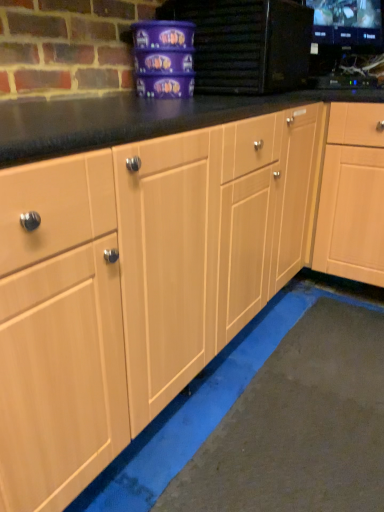
Question: Can you confirm if matte purple container at upper center, the first appliance in the left-to-right sequence, is wider than black glossy monitor at upper right?

Choices:
 (A) yes
 (B) no

Answer: (A)

Question: From a real-world perspective, is matte purple container at upper center, which is the second appliance in right-to-left order, on top of black glossy monitor at upper right?

Choices:
 (A) no
 (B) yes

Answer: (A)

Question: From the image's perspective, is matte purple container at upper center, the first appliance in the left-to-right sequence, located beneath black glossy monitor at upper right?

Choices:
 (A) yes
 (B) no

Answer: (A)

Question: Can you confirm if matte purple container at upper center, which is the second appliance in right-to-left order, is thinner than black glossy monitor at upper right?

Choices:
 (A) no
 (B) yes

Answer: (A)

Question: Is matte purple container at upper center, which is the second appliance in right-to-left order, smaller than black glossy monitor at upper right?

Choices:
 (A) yes
 (B) no

Answer: (B)

Question: Considering the positions of black glossy monitor at upper right and black glossy tv at upper right, which is the first appliance from right to left, in the image, is black glossy monitor at upper right wider or thinner than black glossy tv at upper right, which is the first appliance from right to left,?

Choices:
 (A) wide
 (B) thin

Answer: (B)

Question: Is black glossy monitor at upper right situated inside black glossy tv at upper right, which is the first appliance from right to left, or outside?

Choices:
 (A) inside
 (B) outside

Answer: (B)

Question: Is point (380, 10) closer or farther from the camera than point (321, 79)?

Choices:
 (A) closer
 (B) farther

Answer: (B)

Question: Is black glossy monitor at upper right in front of or behind black glossy tv at upper right, the second appliance when ordered from left to right, in the image?

Choices:
 (A) behind
 (B) front

Answer: (B)

Question: Considering the relative positions of light wood cabinet at center and matte purple container at upper center, which is the second appliance in right-to-left order, in the image provided, is light wood cabinet at center to the left or to the right of matte purple container at upper center, which is the second appliance in right-to-left order,?

Choices:
 (A) left
 (B) right

Answer: (B)

Question: Relative to matte purple container at upper center, the first appliance in the left-to-right sequence, is light wood cabinet at center in front or behind?

Choices:
 (A) behind
 (B) front

Answer: (A)

Question: Do you think light wood cabinet at center is within matte purple container at upper center, which is the second appliance in right-to-left order, or outside of it?

Choices:
 (A) outside
 (B) inside

Answer: (A)

Question: Considering the positions of light wood cabinet at center and matte purple container at upper center, the first appliance in the left-to-right sequence, in the image, is light wood cabinet at center bigger or smaller than matte purple container at upper center, the first appliance in the left-to-right sequence,?

Choices:
 (A) big
 (B) small

Answer: (A)

Question: In terms of height, does matte purple container at upper center, which is the second appliance in right-to-left order, look taller or shorter compared to black glossy tv at upper right, which is the first appliance from right to left?

Choices:
 (A) tall
 (B) short

Answer: (A)

Question: Considering the positions of matte purple container at upper center, the first appliance in the left-to-right sequence, and black glossy tv at upper right, the second appliance when ordered from left to right, in the image, is matte purple container at upper center, the first appliance in the left-to-right sequence, bigger or smaller than black glossy tv at upper right, the second appliance when ordered from left to right,?

Choices:
 (A) big
 (B) small

Answer: (A)